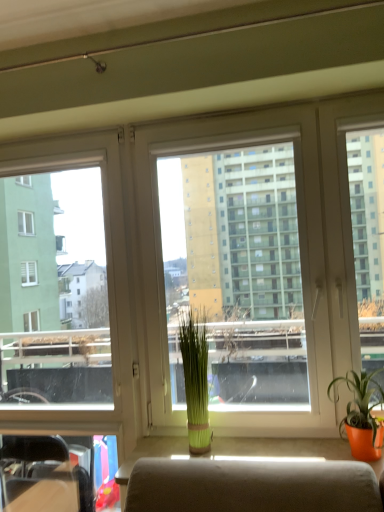
Describe the element at coordinates (65, 316) in the screenshot. I see `transparent glass window at left` at that location.

Measure the distance between matte orange pot at right, arranged as the first houseplant when viewed from the right, and camera.

They are 5.04 feet apart.

Describe the element at coordinates (196, 381) in the screenshot. I see `green matte plant at center, the first houseplant viewed from the back` at that location.

Measure the distance between point (247,159) and camera.

A distance of 1.89 meters exists between point (247,159) and camera.

What are the coordinates of `transparent glass window at left` in the screenshot? It's located at (65, 316).

Is point (361, 415) closer or farther from the camera than point (353, 298)?

Clearly, point (361, 415) is closer to the camera than point (353, 298).

Considering the sizes of matte orange pot at right, the 1th houseplant positioned from the front, and transparent plastic window screen at center in the image, is matte orange pot at right, the 1th houseplant positioned from the front, taller or shorter than transparent plastic window screen at center?

Considering their sizes, matte orange pot at right, the 1th houseplant positioned from the front, has less height than transparent plastic window screen at center.

From the image's perspective, would you say matte orange pot at right, which appears as the second houseplant when viewed from the left, is shown under transparent plastic window screen at center?

Yes, from the image's perspective, matte orange pot at right, which appears as the second houseplant when viewed from the left, is below transparent plastic window screen at center.

Is transparent plastic window screen at center far from transparent glass window at left?

That's not correct — transparent plastic window screen at center is a little close to transparent glass window at left.

Consider the image. From a real-world perspective, who is located lower, transparent plastic window screen at center or transparent glass window at left?

From a 3D spatial view, transparent glass window at left is below.

Does transparent plastic window screen at center have a greater height compared to transparent glass window at left?

In fact, transparent plastic window screen at center may be shorter than transparent glass window at left.

From the image's perspective, relative to transparent glass window at left, is transparent plastic window screen at center above or below?

transparent plastic window screen at center is situated higher than transparent glass window at left in the image.

Is transparent plastic window screen at center taller than green matte plant at center, marked as the second houseplant in a front-to-back arrangement?

Yes.

From a real-world perspective, is transparent plastic window screen at center physically below green matte plant at center, marked as the second houseplant in a front-to-back arrangement?

No, from a real-world perspective, transparent plastic window screen at center is not below green matte plant at center, marked as the second houseplant in a front-to-back arrangement.

Does transparent plastic window screen at center lie behind green matte plant at center, which ranks as the 2th houseplant in right-to-left order?

No, transparent plastic window screen at center is in front of green matte plant at center, which ranks as the 2th houseplant in right-to-left order.

Does transparent plastic window screen at center have a larger size compared to green matte plant at center, which ranks as the 2th houseplant in right-to-left order?

Correct, transparent plastic window screen at center is larger in size than green matte plant at center, which ranks as the 2th houseplant in right-to-left order.

Considering the relative sizes of transparent plastic window screen at center and matte orange pot at right, arranged as the first houseplant when viewed from the right, in the image provided, is transparent plastic window screen at center smaller than matte orange pot at right, arranged as the first houseplant when viewed from the right,?

No.

Is transparent plastic window screen at center beside matte orange pot at right, the 2th houseplant viewed from the back?

transparent plastic window screen at center and matte orange pot at right, the 2th houseplant viewed from the back, are clearly separated.

Is transparent plastic window screen at center oriented towards matte orange pot at right, which appears as the second houseplant when viewed from the left?

Yes, transparent plastic window screen at center faces towards matte orange pot at right, which appears as the second houseplant when viewed from the left.

Between green matte plant at center, which is the 1th houseplant in left-to-right order, and transparent plastic window screen at center, which one is positioned in front?

transparent plastic window screen at center is more forward.

Image resolution: width=384 pixels, height=512 pixels. In order to click on window screen that appears on the right of green matte plant at center, the first houseplant viewed from the back in this screenshot , I will do `click(267, 258)`.

Does green matte plant at center, which is the 1th houseplant in left-to-right order, touch transparent plastic window screen at center?

green matte plant at center, which is the 1th houseplant in left-to-right order, and transparent plastic window screen at center are clearly separated.

From a real-world perspective, between green matte plant at center, which is the 1th houseplant in left-to-right order, and transparent plastic window screen at center, who is vertically higher?

From a 3D spatial view, transparent plastic window screen at center is above.

From the picture: Which of these two, green matte plant at center, which is the 1th houseplant in left-to-right order, or matte orange pot at right, which appears as the second houseplant when viewed from the left, is thinner?

green matte plant at center, which is the 1th houseplant in left-to-right order.

Which is behind, point (179, 323) or point (359, 406)?

Point (179, 323)

Looking at this image, is matte orange pot at right, the 1th houseplant positioned from the front, at the back of green matte plant at center, the first houseplant viewed from the back?

green matte plant at center, the first houseplant viewed from the back, is not turned away from matte orange pot at right, the 1th houseplant positioned from the front.

Who is smaller, green matte plant at center, the first houseplant viewed from the back, or matte orange pot at right, which appears as the second houseplant when viewed from the left?

green matte plant at center, the first houseplant viewed from the back, is smaller.

Between transparent glass window at left and transparent plastic window screen at center, which one has larger size?

transparent plastic window screen at center is bigger.

Based on the photo, from the image's perspective, would you say transparent glass window at left is positioned over transparent plastic window screen at center?

No, from the image's perspective, transparent glass window at left is not on top of transparent plastic window screen at center.

Consider the image. Relative to transparent plastic window screen at center, is transparent glass window at left in front or behind?

transparent glass window at left is behind transparent plastic window screen at center.

In terms of width, does transparent glass window at left look wider or thinner when compared to transparent plastic window screen at center?

Clearly, transparent glass window at left has less width compared to transparent plastic window screen at center.

From a real-world perspective, count 2nd houseplants downward from the transparent plastic window screen at center and point to it. Please provide its 2D coordinates.

[(362, 414)]

Identify the location of window screen on the right side of transparent glass window at left. (267, 258).

Estimate the real-world distances between objects in this image. Which object is further from transparent glass window at left, transparent plastic window screen at center or matte orange pot at right, the 2th houseplant viewed from the back?

matte orange pot at right, the 2th houseplant viewed from the back, is positioned further to the anchor transparent glass window at left.

When comparing their distances from transparent plastic window screen at center, does transparent glass window at left or green matte plant at center, marked as the second houseplant in a front-to-back arrangement, seem closer?

green matte plant at center, marked as the second houseplant in a front-to-back arrangement, is closer to transparent plastic window screen at center.

Considering their positions, is matte orange pot at right, the 1th houseplant positioned from the front, positioned closer to transparent glass window at left than transparent plastic window screen at center?

transparent plastic window screen at center.

Considering their positions, is green matte plant at center, marked as the second houseplant in a front-to-back arrangement, positioned closer to transparent plastic window screen at center than transparent glass window at left?

Based on the image, green matte plant at center, marked as the second houseplant in a front-to-back arrangement, appears to be nearer to transparent plastic window screen at center.

Considering their positions, is green matte plant at center, which ranks as the 2th houseplant in right-to-left order, positioned closer to matte orange pot at right, which appears as the second houseplant when viewed from the left, than transparent glass window at left?

green matte plant at center, which ranks as the 2th houseplant in right-to-left order, lies closer to matte orange pot at right, which appears as the second houseplant when viewed from the left, than the other object.

Which object lies further to the anchor point matte orange pot at right, the 2th houseplant viewed from the back, transparent plastic window screen at center or green matte plant at center, the first houseplant viewed from the back?

green matte plant at center, the first houseplant viewed from the back, lies further to matte orange pot at right, the 2th houseplant viewed from the back, than the other object.

Estimate the real-world distances between objects in this image. Which object is closer to green matte plant at center, the first houseplant viewed from the back, transparent glass window at left or matte orange pot at right, arranged as the first houseplant when viewed from the right?

Among the two, transparent glass window at left is located nearer to green matte plant at center, the first houseplant viewed from the back.

Looking at the image, which one is located closer to matte orange pot at right, the 1th houseplant positioned from the front, transparent plastic window screen at center or transparent glass window at left?

transparent plastic window screen at center is closer to matte orange pot at right, the 1th houseplant positioned from the front.

Where is `window screen between green matte plant at center, which ranks as the 2th houseplant in right-to-left order, and matte orange pot at right, the 1th houseplant positioned from the front, from left to right`? This screenshot has height=512, width=384. window screen between green matte plant at center, which ranks as the 2th houseplant in right-to-left order, and matte orange pot at right, the 1th houseplant positioned from the front, from left to right is located at coordinates (267, 258).

This screenshot has height=512, width=384. What are the coordinates of `houseplant between transparent glass window at left and transparent plastic window screen at center in the horizontal direction` in the screenshot? It's located at (196, 381).

Image resolution: width=384 pixels, height=512 pixels. Identify the location of houseplant between transparent glass window at left and matte orange pot at right, the 1th houseplant positioned from the front. (196, 381).

Locate an element on the screen. The image size is (384, 512). window screen between transparent glass window at left and matte orange pot at right, the 1th houseplant positioned from the front, in the horizontal direction is located at coordinates (267, 258).